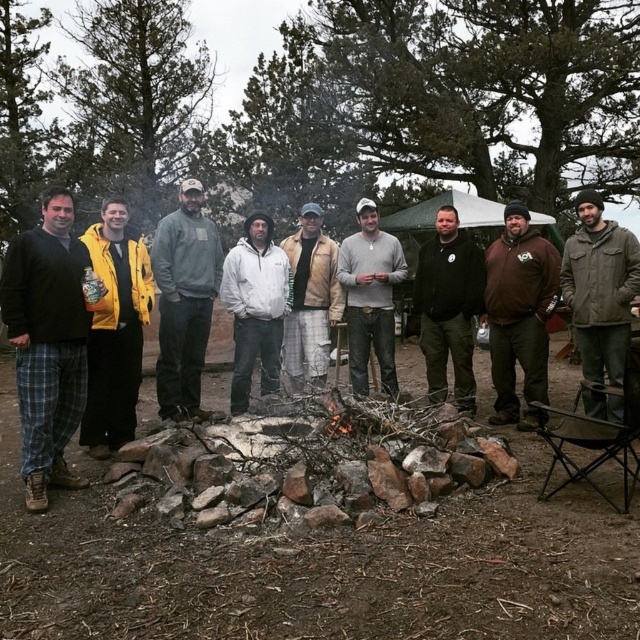
You are standing at the fire pit in the center of the campsite. You need to walk to a specific location marked by point (51, 435) and another location marked by point (532, 305). Which point should you reach first if you want to visit both points in the shortest path possible?

You should reach point (51, 435) first because it is in front of point (532, 305), so visiting it first allows you to proceed to the second point without backtracking.

You are a photographer trying to capture a photo of the light gray sweater at center without including the yellow matte jacket at left in the frame. Based on their positions, is this possible?

The yellow matte jacket at left is in front of the light gray sweater at center, so it would block the view. To capture the light gray sweater at center without the yellow matte jacket at left, you would need to move around to a different angle where the yellow matte jacket at left is no longer in front.

You are standing at the campsite and want to take a photo of the two points marked in the scene. Which point, point [134,291] or point [492,378], will appear larger in your camera view?

Point [134,291] will appear larger in the camera view because it is closer to the camera than point [492,378].